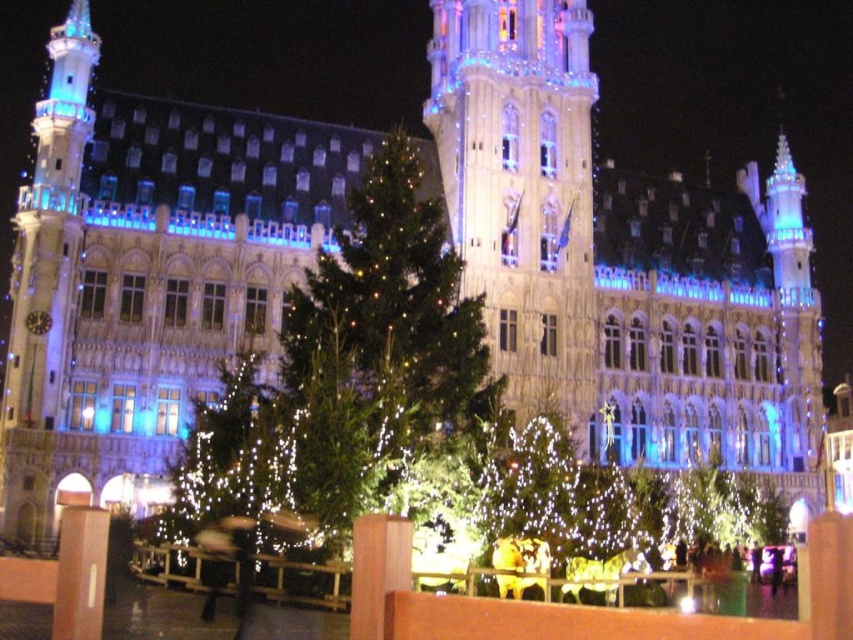
You are a visitor standing at the waterfront and want to take a photo that includes both the illuminated stone tower at center and the green matte tree at center. Which object should you position closer to the camera to ensure both are fully visible in the frame?

The green matte tree at center should be positioned closer to the camera because the illuminated stone tower at center is larger in size. By placing the smaller green matte tree at center nearer, both objects will fit within the camera frame more effectively.

You are standing on the waterfront and see the illuminated stone tower at center and the green matte tree at center. Which object is positioned to the right of the other?

→ The illuminated stone tower at center is to the right of the green matte tree at center.

In the scene shown: You are a photographer planning to capture the illuminated stone tower at center and the green matte tree at center in a single shot. Which object will appear narrower in your photo?

The illuminated stone tower at center will appear narrower in the photo since it is thinner than the green matte tree at center.